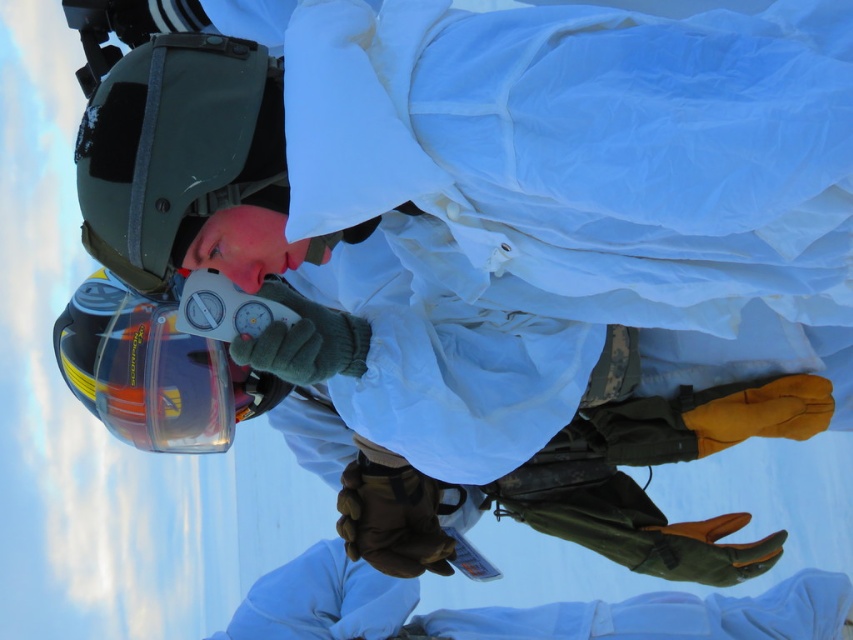
Who is shorter, matte green glove at center or translucent orange helmet at lower left?

matte green glove at center is shorter.

Who is more distant from viewer, (543, 608) or (76, 380)?

Positioned behind is point (543, 608).

The height and width of the screenshot is (640, 853). What are the coordinates of `matte green glove at center` in the screenshot? It's located at (521, 609).

Is glossy black helmet at upper left further to the viewer compared to translucent orange helmet at lower left?

No, glossy black helmet at upper left is in front of translucent orange helmet at lower left.

Is glossy black helmet at upper left above translucent orange helmet at lower left?

Indeed, glossy black helmet at upper left is positioned over translucent orange helmet at lower left.

Is point (97, 218) farther from viewer compared to point (119, 428)?

No, it is not.

Where is `glossy black helmet at upper left`? The width and height of the screenshot is (853, 640). glossy black helmet at upper left is located at coordinates (175, 148).

Who is taller, matte white snowboard at center or glossy black helmet at upper left?

Standing taller between the two is matte white snowboard at center.

Is matte white snowboard at center closer to camera compared to glossy black helmet at upper left?

No, matte white snowboard at center is further to the viewer.

Who is more forward, (593,481) or (119,164)?

Point (119,164) is in front.

In order to click on matte white snowboard at center in this screenshot , I will do 654,465.